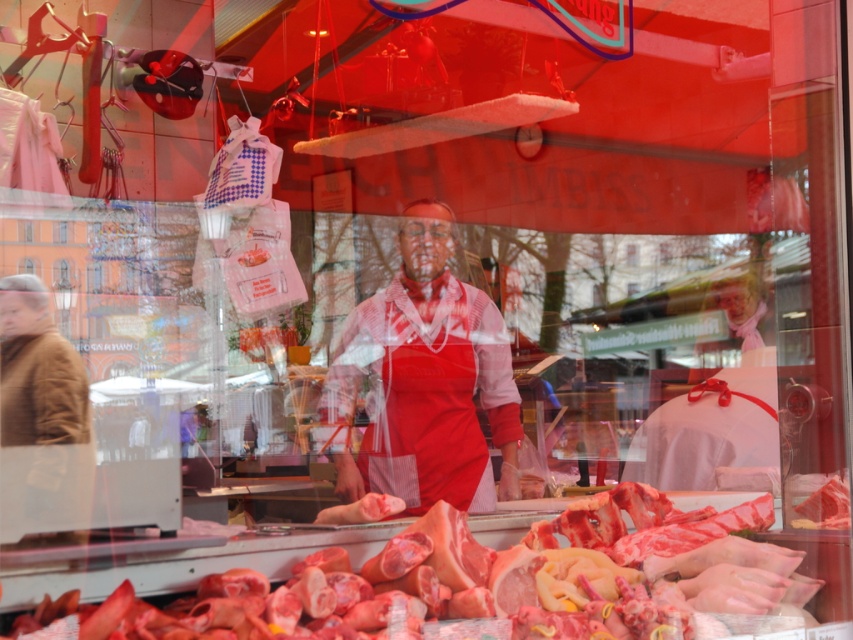
Which is more to the left, pinkish raw meat at center or brown wool coat at left?

brown wool coat at left is more to the left.

Can you confirm if pinkish raw meat at center is smaller than brown wool coat at left?

Actually, pinkish raw meat at center might be larger than brown wool coat at left.

Is point (407, 608) closer to camera compared to point (90, 476)?

No, it is behind (90, 476).

The image size is (853, 640). Identify the location of pinkish raw meat at center. (480, 588).

Is red plaid shirt at center wider than brown wool coat at left?

Correct, the width of red plaid shirt at center exceeds that of brown wool coat at left.

Is the position of red plaid shirt at center more distant than that of brown wool coat at left?

Yes, it is behind brown wool coat at left.

Between point (473, 384) and point (44, 301), which one is positioned in front?

Point (44, 301)

Where is `red plaid shirt at center`? The width and height of the screenshot is (853, 640). red plaid shirt at center is located at coordinates (425, 380).

Who is positioned more to the right, pinkish raw meat at center or red plaid shirt at center?

pinkish raw meat at center

What do you see at coordinates (480, 588) in the screenshot? I see `pinkish raw meat at center` at bounding box center [480, 588].

At what (x,y) coordinates should I click in order to perform the action: click on pinkish raw meat at center. Please return your answer as a coordinate pair (x, y). The image size is (853, 640). Looking at the image, I should click on (480, 588).